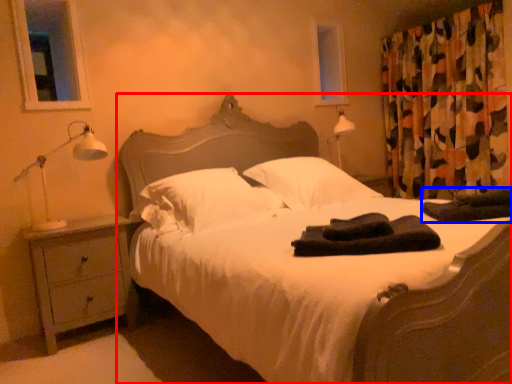
Question: Which object appears farthest to the camera in this image, bed (highlighted by a red box) or material (highlighted by a blue box)?

Choices:
 (A) bed
 (B) material

Answer: (B)